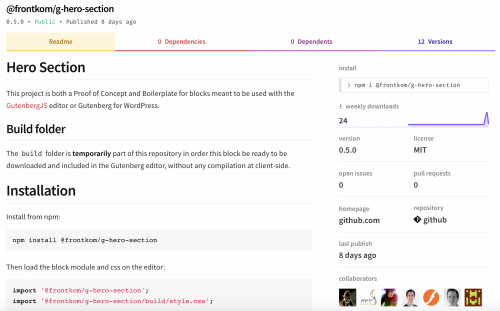
At what (x,y) coordinates should I click in order to perform the action: click on box. Please return your answer as a coordinate pair (x, y). Image resolution: width=500 pixels, height=311 pixels. Looking at the image, I should click on (208, 242), (269, 308), (477, 85).